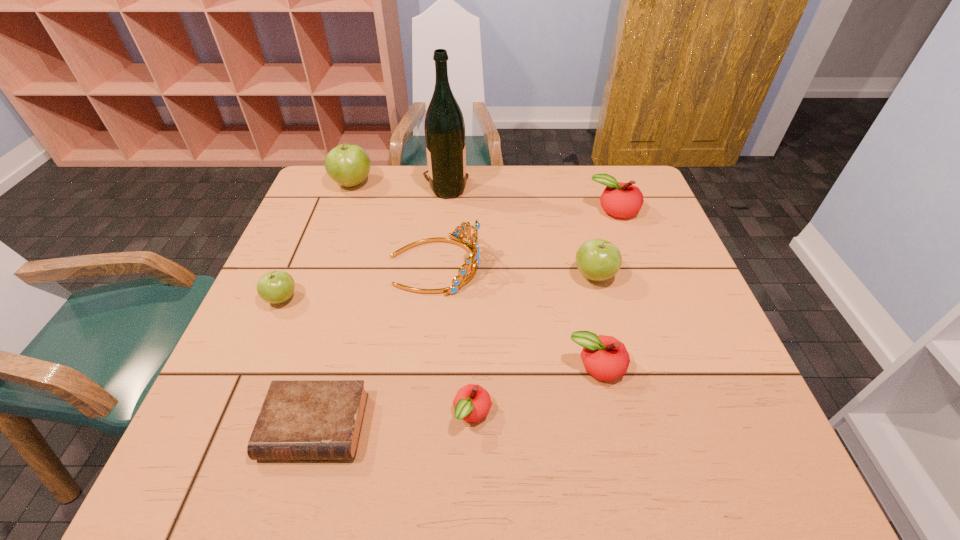
Locate an element on the screen. Image resolution: width=960 pixels, height=540 pixels. vacant point that satisfies the following two spatial constraints: 1. on the front-facing side of the gold tiara; 2. on the spine side of the shortest object is located at coordinates (418, 427).

Where is `vacant region that satisfies the following two spatial constraints: 1. on the front side of the wine bottle; 2. on the front-facing side of the gold tiara`? vacant region that satisfies the following two spatial constraints: 1. on the front side of the wine bottle; 2. on the front-facing side of the gold tiara is located at coordinates (438, 265).

Image resolution: width=960 pixels, height=540 pixels. I want to click on vacant space that satisfies the following two spatial constraints: 1. on the front side of the rightmost green apple; 2. on the left side of the biggest green apple, so (319, 276).